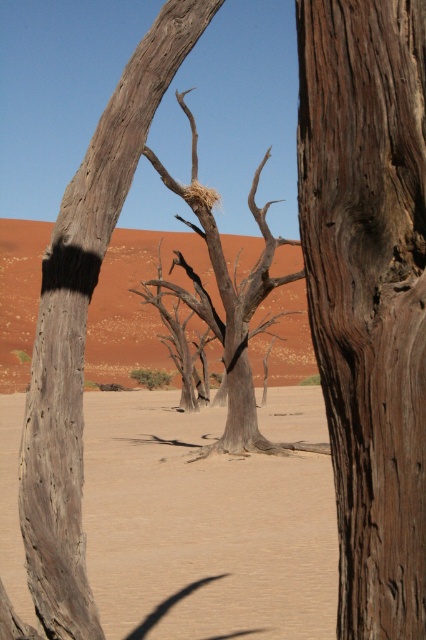
The width and height of the screenshot is (426, 640). Describe the element at coordinates (203, 528) in the screenshot. I see `sandy beige desert at center` at that location.

Is the position of sandy beige desert at center more distant than that of dead brown tree at center?

Yes, sandy beige desert at center is behind dead brown tree at center.

Where is `sandy beige desert at center`? sandy beige desert at center is located at coordinates (203, 528).

Does dark brown wood at center have a smaller size compared to rough bark tree at center?

Yes.

Can you confirm if dark brown wood at center is positioned below rough bark tree at center?

Yes, dark brown wood at center is below rough bark tree at center.

Is point (313, 241) closer to camera compared to point (60, 385)?

Yes.

Identify the location of dark brown wood at center. Image resolution: width=426 pixels, height=640 pixels. (368, 291).

Does sandy beige desert at center appear over rough bark tree at center?

Incorrect, sandy beige desert at center is not positioned above rough bark tree at center.

Is point (258, 470) farther from camera compared to point (81, 365)?

Yes.

Is point (207, 412) positioned in front of point (95, 172)?

No, it is behind (95, 172).

Where is `sandy beige desert at center`? Image resolution: width=426 pixels, height=640 pixels. sandy beige desert at center is located at coordinates (203, 528).